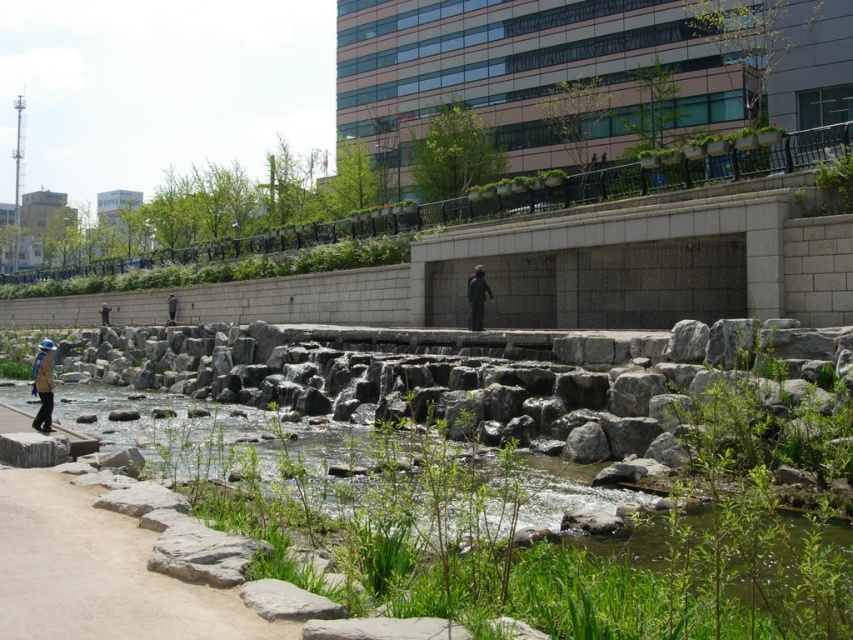
You are standing at the center of the park and want to reach the sandy beige path at lower left. Based on the coordinates provided, in which general direction should you walk to reach it?

The sandy beige path at lower left is located at coordinates point (99, 573), so you should walk towards the lower left direction to reach it.

From the picture: You are standing on the paved pathway next to the stream and see the blue fabric hat at left and the dark gray concrete person at center. Which object is closer to the stream?

The blue fabric hat at left is closer to the stream because it is positioned below the dark gray concrete person at center, indicating it is lower and nearer to the waterway.